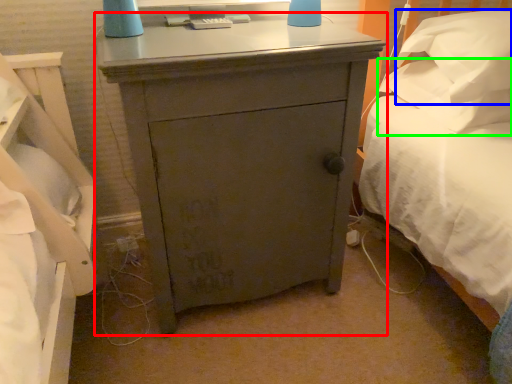
Question: Which is farther away from nightstand (highlighted by a red box)? pillow (highlighted by a blue box) or pillow (highlighted by a green box)?

Choices:
 (A) pillow
 (B) pillow

Answer: (B)